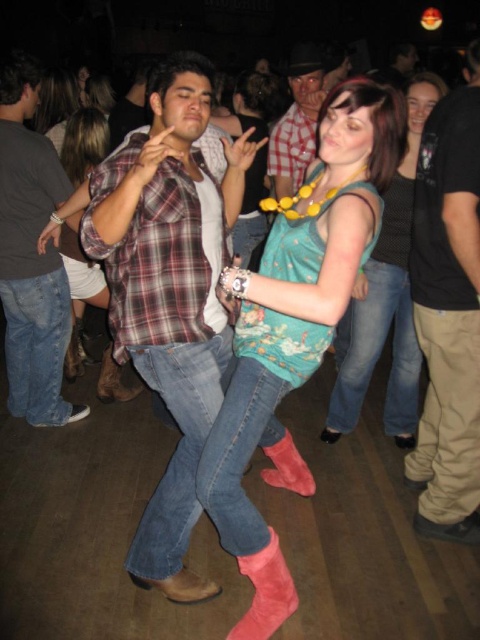
You are standing at the entrance of the dance floor and want to locate the plaid shirt at center. According to the coordinates given, where should you look to find it?

The plaid shirt at center is located at coordinates point (169, 292).